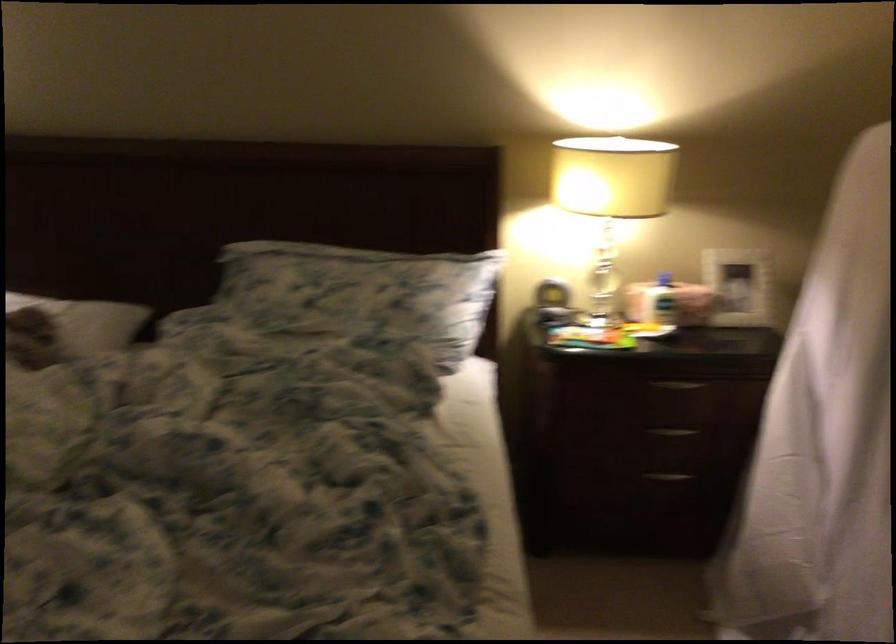
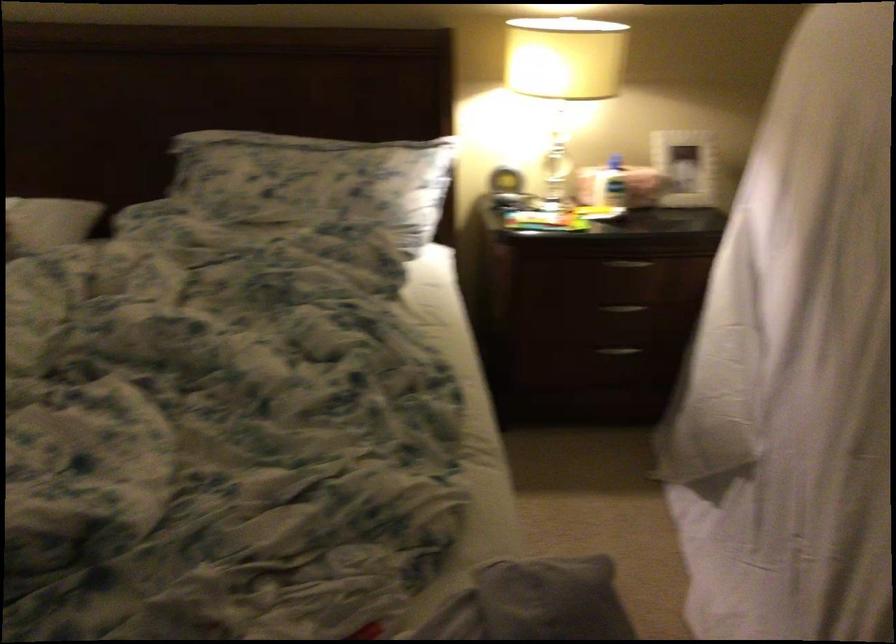
Where in the second image is the point corresponding to [666,483] from the first image?

(616, 355)